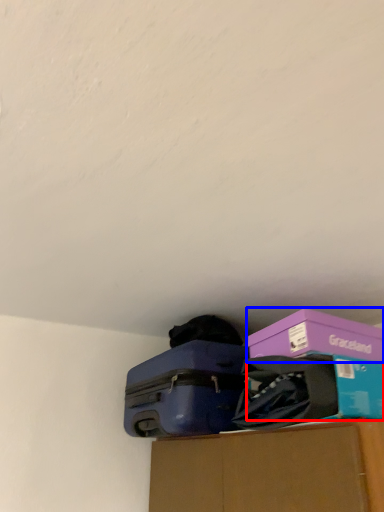
Question: Which object is closer to the camera taking this photo, storage box (highlighted by a red box) or box (highlighted by a blue box)?

Choices:
 (A) storage box
 (B) box

Answer: (A)